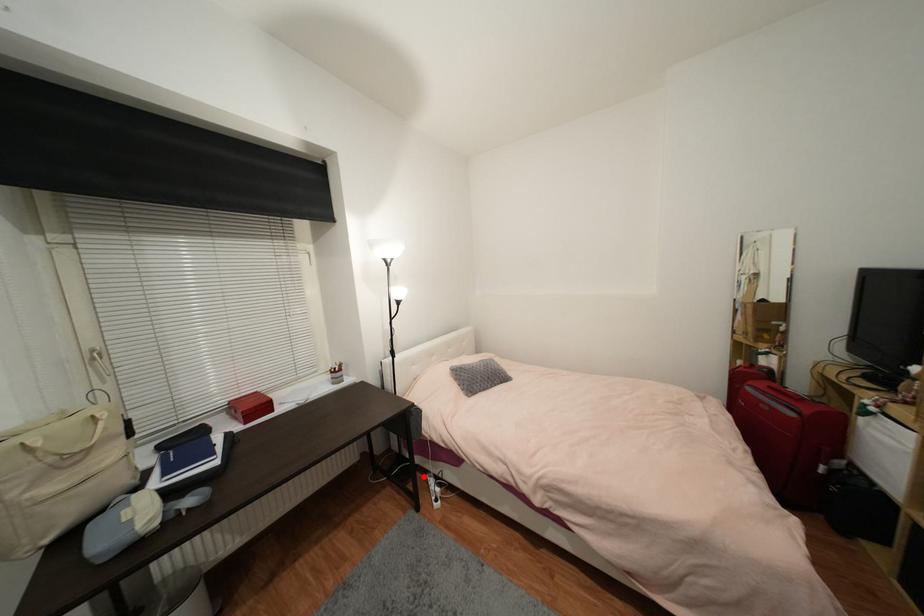
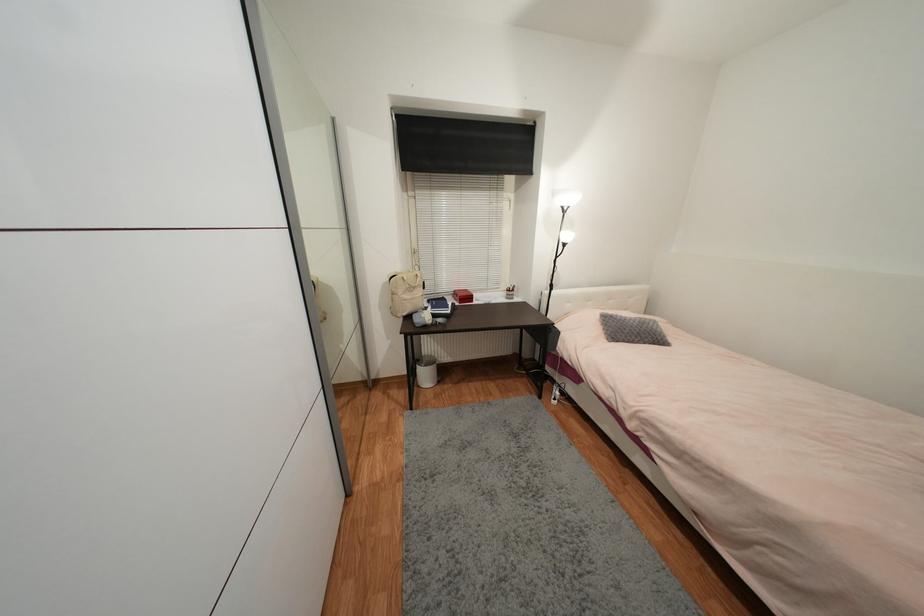
Question: A red point is marked in image1. In image2, is the corresponding 3D point closer to the camera or farther? Reply with the corresponding letter.

Choices:
 (A) The corresponding 3D point is closer.
 (B) The corresponding 3D point is farther.

Answer: (A)